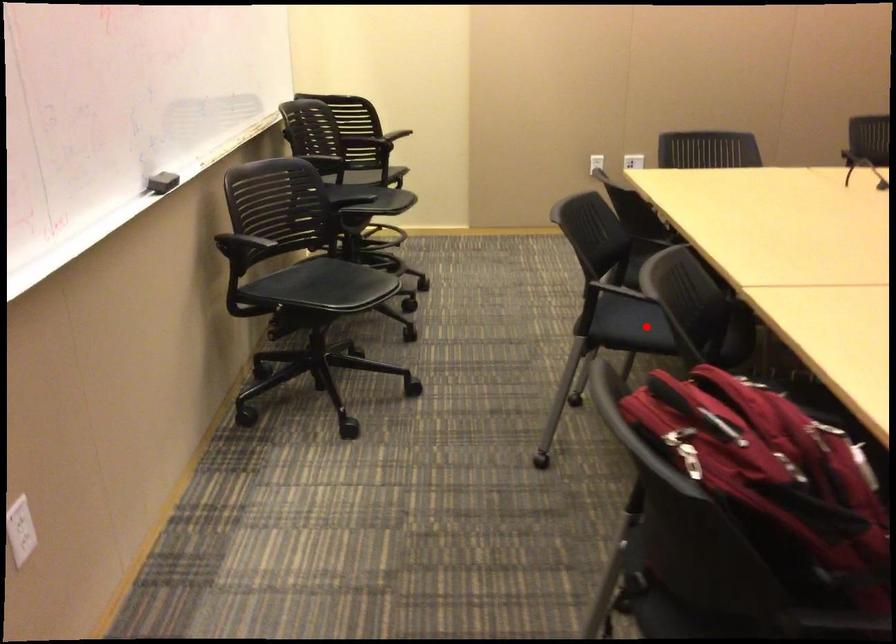
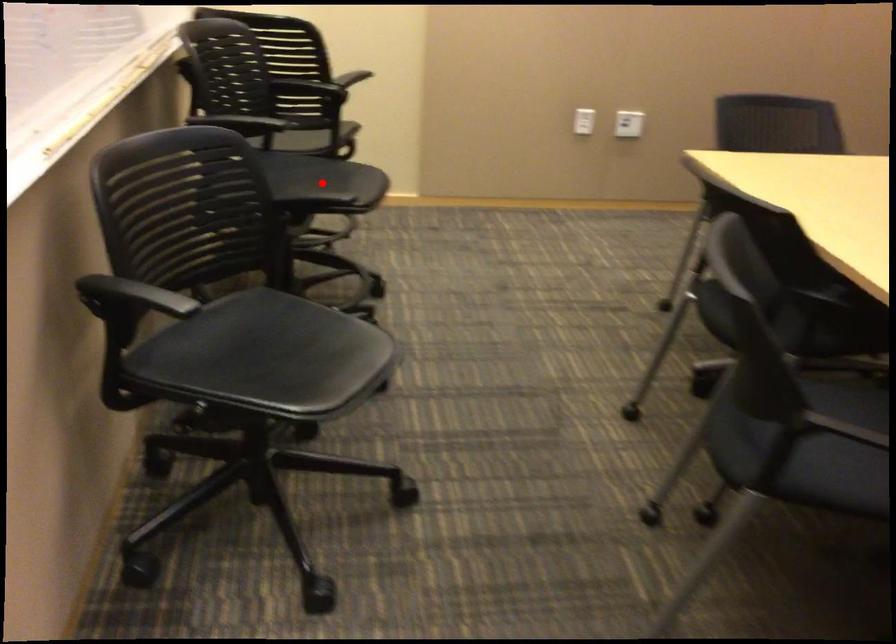
I am providing you with two images of the same scene from different viewpoints. A red point is marked on the first image and another point is marked on the second image. Do the highlighted points in image1 and image2 indicate the same real-world spot?

No